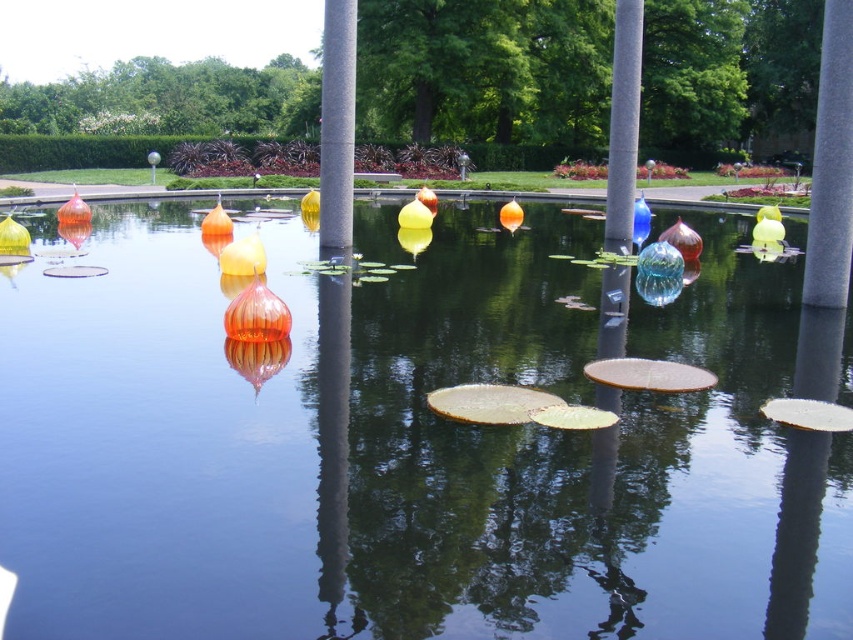
Question: Considering the relative positions of translucent glass orbs at center and gray stone pole at center in the image provided, where is translucent glass orbs at center located with respect to gray stone pole at center?

Choices:
 (A) below
 (B) above

Answer: (A)

Question: Which object appears farthest from the camera in this image?

Choices:
 (A) translucent glass orbs at center
 (B) gray stone pole at center

Answer: (B)

Question: Does translucent glass orbs at center have a greater width compared to gray stone pole at center?

Choices:
 (A) yes
 (B) no

Answer: (A)

Question: From the image, what is the correct spatial relationship of translucent glass orbs at center in relation to gray stone pole at center?

Choices:
 (A) right
 (B) left

Answer: (A)

Question: Which of the following is the farthest from the observer?

Choices:
 (A) gray stone pole at center
 (B) translucent glass orbs at center

Answer: (A)